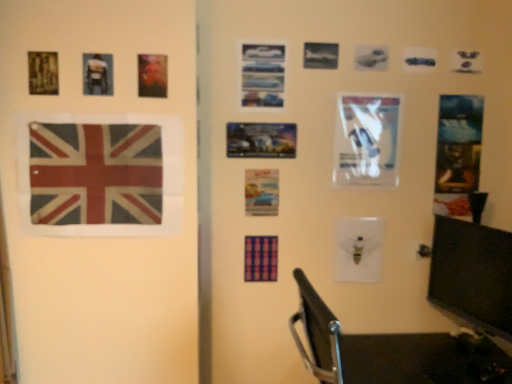
Question: Are pastel paper postcard at center, which is counted as the fourth postcard, starting from the right, and matte black backpack at upper left, placed as the 2th picture frame when sorted from back to front, far apart?

Choices:
 (A) yes
 (B) no

Answer: (B)

Question: Can you confirm if pastel paper postcard at center, marked as the 4th postcard in a front-to-back arrangement, is shorter than matte black backpack at upper left, which ranks as the second picture frame in bottom-to-top order?

Choices:
 (A) no
 (B) yes

Answer: (A)

Question: From a real-world perspective, is pastel paper postcard at center, which appears as the 2th postcard when viewed from the left, over matte black backpack at upper left, positioned as the 2th picture frame in right-to-left order?

Choices:
 (A) no
 (B) yes

Answer: (A)

Question: Considering the relative sizes of pastel paper postcard at center, which appears as the 2th postcard when viewed from the left, and matte black backpack at upper left, marked as the 1th picture frame in a left-to-right arrangement, in the image provided, is pastel paper postcard at center, which appears as the 2th postcard when viewed from the left, smaller than matte black backpack at upper left, marked as the 1th picture frame in a left-to-right arrangement,?

Choices:
 (A) yes
 (B) no

Answer: (B)

Question: Does pastel paper postcard at center, which appears as the 2th postcard when viewed from the left, have a greater height compared to matte black backpack at upper left, placed as the 2th picture frame when sorted from back to front?

Choices:
 (A) yes
 (B) no

Answer: (A)

Question: Is pastel paper postcard at center, marked as the 4th postcard in a front-to-back arrangement, positioned in front of matte black backpack at upper left, which is the 1th picture frame in front-to-back order?

Choices:
 (A) no
 (B) yes

Answer: (A)

Question: Can you confirm if metallic silver poster at right, the 1th postcard positioned from the right, is wider than white glossy paper at center right, which is counted as the third postcard, starting from the front?

Choices:
 (A) no
 (B) yes

Answer: (A)

Question: Is metallic silver poster at right, which is the 5th postcard from front to back, facing away from white glossy paper at center right, the 2th postcard viewed from the right?

Choices:
 (A) no
 (B) yes

Answer: (A)

Question: Can you confirm if metallic silver poster at right, which is the 5th postcard from front to back, is taller than white glossy paper at center right, the fourth postcard positioned from the left?

Choices:
 (A) no
 (B) yes

Answer: (B)

Question: From the image's perspective, is metallic silver poster at right, the 1th postcard positioned from the right, above white glossy paper at center right, the 2th postcard viewed from the right?

Choices:
 (A) yes
 (B) no

Answer: (B)

Question: Is metallic silver poster at right, the 1th postcard positioned from the back, behind white glossy paper at center right, which is counted as the third postcard, starting from the front?

Choices:
 (A) yes
 (B) no

Answer: (A)

Question: Is metallic silver poster at right, the 1th postcard positioned from the back, at the left side of white glossy paper at center right, the fourth postcard positioned from the left?

Choices:
 (A) no
 (B) yes

Answer: (A)

Question: From a real-world perspective, is textured fabric flag at left positioned over pastel paper postcard at center, marked as the 4th postcard in a front-to-back arrangement, based on gravity?

Choices:
 (A) yes
 (B) no

Answer: (A)